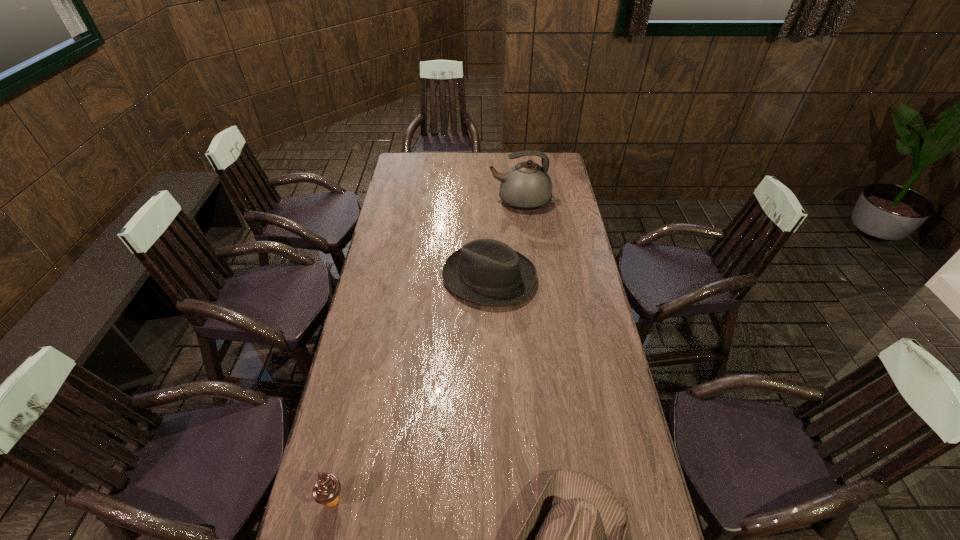
Image resolution: width=960 pixels, height=540 pixels. I want to click on object that is at the right edge, so click(x=526, y=186).

Find the location of `free space at the far edge of the desktop`. free space at the far edge of the desktop is located at coordinates (518, 160).

Locate an element on the screen. This screenshot has width=960, height=540. vacant space at the left edge of the desktop is located at coordinates (354, 521).

At what (x,y) coordinates should I click in order to perform the action: click on blank area at the right edge. Please return your answer as a coordinate pair (x, y). This screenshot has height=540, width=960. Looking at the image, I should click on (592, 299).

I want to click on vacant point at the far left corner, so click(x=420, y=156).

The image size is (960, 540). Find the location of `vacant region at the far right corner of the desktop`. vacant region at the far right corner of the desktop is located at coordinates (557, 165).

You are a GUI agent. You are given a task and a screenshot of the screen. Output one action in this format:
    pyautogui.click(x=<x>, y=<y>)
    Task: Click on the unoccupied position between the farthest object and the icecream
    This screenshot has height=540, width=960.
    Given the screenshot: What is the action you would take?
    pyautogui.click(x=427, y=350)

Find the location of a particular element. This screenshot has height=540, width=960. vacant space that's between the farthest object and the icecream is located at coordinates (427, 350).

At what (x,y) coordinates should I click in order to perform the action: click on free area in between the farther fedora and the farthest object. Please return your answer as a coordinate pair (x, y). This screenshot has height=540, width=960. Looking at the image, I should click on (505, 239).

In order to click on empty space that is in between the tallest object and the second farthest object in this screenshot , I will do `click(505, 239)`.